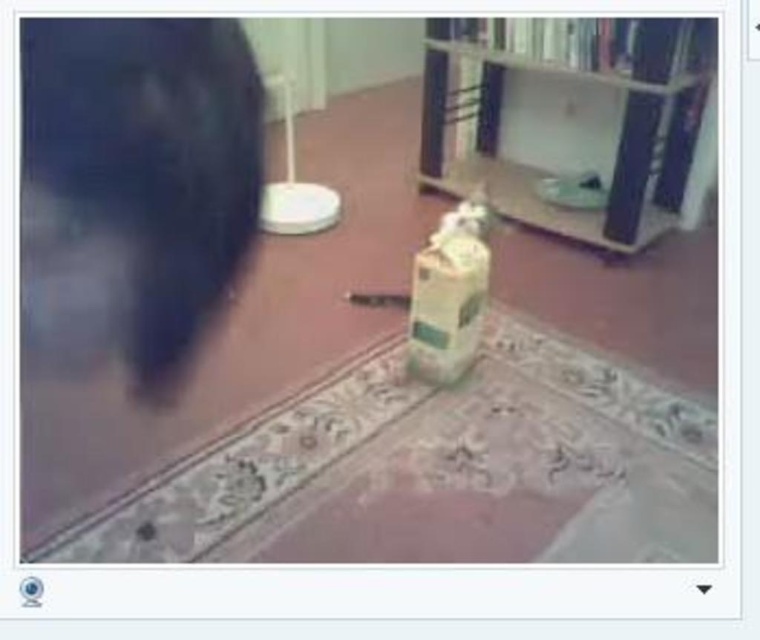
Does white glossy bookshelf at upper center have a lesser height compared to matte plastic bottle at center?

No, white glossy bookshelf at upper center is not shorter than matte plastic bottle at center.

The height and width of the screenshot is (640, 760). What do you see at coordinates (575, 120) in the screenshot?
I see `white glossy bookshelf at upper center` at bounding box center [575, 120].

Locate an element on the screen. white glossy bookshelf at upper center is located at coordinates point(575,120).